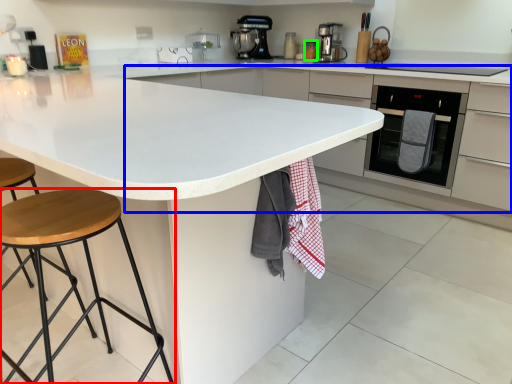
Question: Considering the real-world distances, which object is closest to stool (highlighted by a red box)? cabinetry (highlighted by a blue box) or appliance (highlighted by a green box).

Choices:
 (A) cabinetry
 (B) appliance

Answer: (A)